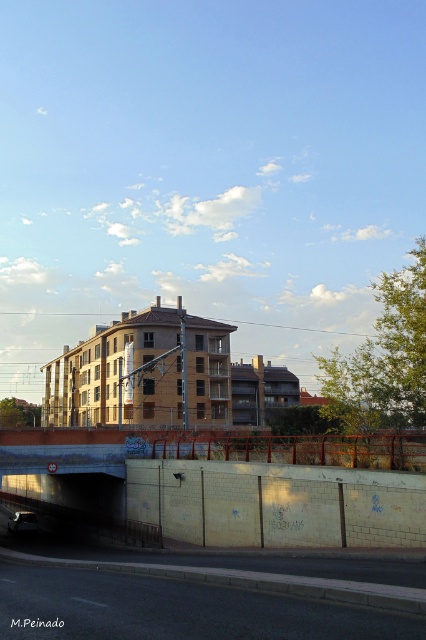
Question: Is black asphalt highway at lower left to the right of shiny silver car at lower left from the viewer's perspective?

Choices:
 (A) no
 (B) yes

Answer: (B)

Question: Can you confirm if black asphalt highway at lower left is smaller than shiny silver car at lower left?

Choices:
 (A) no
 (B) yes

Answer: (A)

Question: Is black asphalt highway at lower left further to the viewer compared to shiny silver car at lower left?

Choices:
 (A) yes
 (B) no

Answer: (B)

Question: Among these objects, which one is farthest from the camera?

Choices:
 (A) shiny silver car at lower left
 (B) black asphalt highway at lower left

Answer: (A)